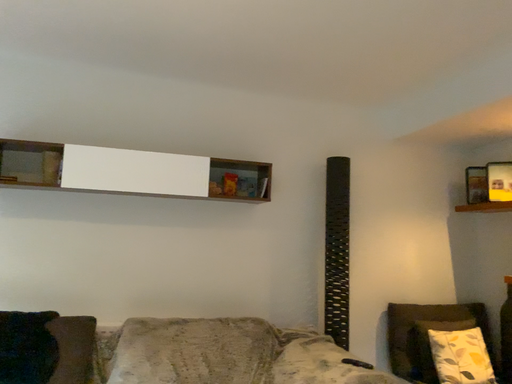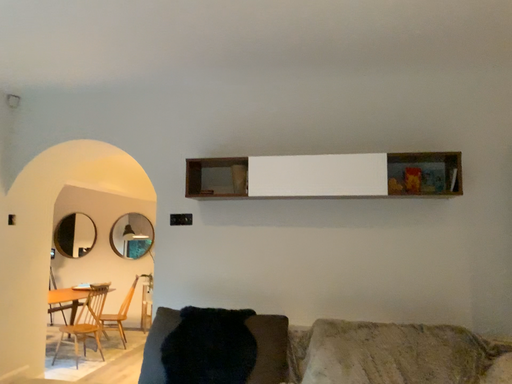
Question: Which way did the camera rotate in the video?

Choices:
 (A) rotated right
 (B) rotated left

Answer: (B)